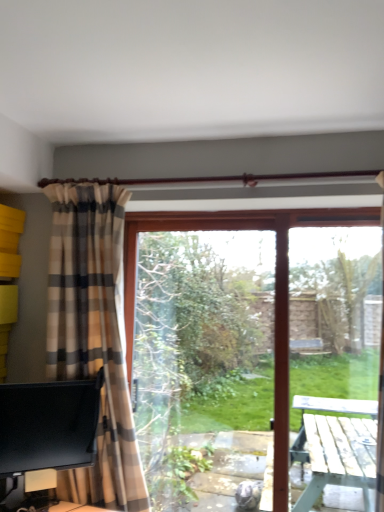
Where is `transparent glass window screen at center`? The image size is (384, 512). transparent glass window screen at center is located at coordinates (207, 326).

The image size is (384, 512). Identify the location of transparent glass window screen at center. (207, 326).

Considering the positions of point (69, 464) and point (193, 360), is point (69, 464) closer or farther from the camera than point (193, 360)?

Point (69, 464) is positioned closer to the camera compared to point (193, 360).

Is black glossy monitor at lower left in contact with transparent glass window screen at center?

black glossy monitor at lower left is not next to transparent glass window screen at center, and they're not touching.

Which of these two, black glossy monitor at lower left or transparent glass window screen at center, is wider?

With larger width is transparent glass window screen at center.

Between black glossy monitor at lower left and transparent glass window screen at center, which one appears on the right side from the viewer's perspective?

From the viewer's perspective, transparent glass window screen at center appears more on the right side.

From a real-world perspective, is transparent glass screen door at right physically below plaid fabric curtain at left?

Yes, from a real-world perspective, transparent glass screen door at right is below plaid fabric curtain at left.

Is transparent glass screen door at right facing towards plaid fabric curtain at left?

No, transparent glass screen door at right is not facing towards plaid fabric curtain at left.

Is the depth of transparent glass screen door at right greater than that of plaid fabric curtain at left?

Yes, it is behind plaid fabric curtain at left.

Considering the positions of objects transparent glass screen door at right and plaid fabric curtain at left in the image provided, who is more to the right, transparent glass screen door at right or plaid fabric curtain at left?

Positioned to the right is transparent glass screen door at right.

Considering the points (79, 192) and (167, 245), which point is behind, point (79, 192) or point (167, 245)?

Point (167, 245)

Can we say plaid fabric curtain at left lies outside transparent glass window screen at center?

That's correct, plaid fabric curtain at left is outside of transparent glass window screen at center.

Is plaid fabric curtain at left behind transparent glass window screen at center?

No, the depth of plaid fabric curtain at left is less than that of transparent glass window screen at center.

This screenshot has width=384, height=512. In order to click on window screen on the right of plaid fabric curtain at left in this screenshot , I will do `click(207, 326)`.

Locate an element on the screen. This screenshot has height=512, width=384. window screen that appears on the left of transparent glass screen door at right is located at coordinates (207, 326).

From the image's perspective, which one is positioned lower, transparent glass window screen at center or transparent glass screen door at right?

transparent glass window screen at center is shown below in the image.

What's the angular difference between transparent glass window screen at center and transparent glass screen door at right's facing directions?

The angular difference between transparent glass window screen at center and transparent glass screen door at right is 7.86e-05 degrees.

Which object is further away from the camera taking this photo, transparent glass window screen at center or transparent glass screen door at right?

transparent glass window screen at center is further from the camera.

Is transparent glass screen door at right next to transparent glass window screen at center?

No, transparent glass screen door at right is not touching transparent glass window screen at center.

Visually, is transparent glass screen door at right positioned to the left or to the right of transparent glass window screen at center?

transparent glass screen door at right is to the right of transparent glass window screen at center.

Could you tell me if transparent glass screen door at right is facing transparent glass window screen at center?

No, transparent glass screen door at right is not facing towards transparent glass window screen at center.

Considering the sizes of objects transparent glass screen door at right and transparent glass window screen at center in the image provided, who is thinner, transparent glass screen door at right or transparent glass window screen at center?

With smaller width is transparent glass window screen at center.

Looking at this image, which of these two, plaid fabric curtain at left or transparent glass screen door at right, is thinner?

transparent glass screen door at right is thinner.

In terms of size, does plaid fabric curtain at left appear bigger or smaller than transparent glass screen door at right?

Considering their sizes, plaid fabric curtain at left takes up more space than transparent glass screen door at right.

Between plaid fabric curtain at left and transparent glass screen door at right, which one appears on the left side from the viewer's perspective?

Positioned to the left is plaid fabric curtain at left.

From the image's perspective, is plaid fabric curtain at left above or below transparent glass screen door at right?

plaid fabric curtain at left is situated higher than transparent glass screen door at right in the image.

From the image's perspective, is transparent glass window screen at center located beneath black glossy monitor at lower left?

Incorrect, from the image's perspective, transparent glass window screen at center is higher than black glossy monitor at lower left.

Can you tell me how much transparent glass window screen at center and black glossy monitor at lower left differ in facing direction?

39.5 degrees separate the facing orientations of transparent glass window screen at center and black glossy monitor at lower left.

Find the location of a particular element. The height and width of the screenshot is (512, 384). window screen above the black glossy monitor at lower left (from a real-world perspective) is located at coordinates (207, 326).

From a real-world perspective, who is located higher, transparent glass window screen at center or black glossy monitor at lower left?

transparent glass window screen at center is physically above.

Identify the location of window screen that is above the black glossy monitor at lower left (from the image's perspective). This screenshot has width=384, height=512. (207, 326).

Where is `curtain above the transparent glass screen door at right (from a real-world perspective)`? Image resolution: width=384 pixels, height=512 pixels. curtain above the transparent glass screen door at right (from a real-world perspective) is located at coordinates (93, 336).

Which object lies nearer to the anchor point transparent glass screen door at right, black glossy monitor at lower left or plaid fabric curtain at left?

plaid fabric curtain at left is closer to transparent glass screen door at right.

Considering their positions, is black glossy monitor at lower left positioned closer to plaid fabric curtain at left than transparent glass screen door at right?

The object closer to plaid fabric curtain at left is black glossy monitor at lower left.

Which object lies further to the anchor point transparent glass screen door at right, black glossy monitor at lower left or transparent glass window screen at center?

Based on the image, black glossy monitor at lower left appears to be further to transparent glass screen door at right.

When comparing their distances from transparent glass screen door at right, does plaid fabric curtain at left or black glossy monitor at lower left seem further?

The object further to transparent glass screen door at right is black glossy monitor at lower left.

From the image, which object appears to be farther from transparent glass screen door at right, plaid fabric curtain at left or transparent glass window screen at center?

plaid fabric curtain at left lies further to transparent glass screen door at right than the other object.

Considering their positions, is transparent glass screen door at right positioned further to transparent glass window screen at center than plaid fabric curtain at left?

transparent glass screen door at right.

When comparing their distances from transparent glass screen door at right, does transparent glass window screen at center or plaid fabric curtain at left seem closer?

Based on the image, transparent glass window screen at center appears to be nearer to transparent glass screen door at right.

Which object lies nearer to the anchor point transparent glass window screen at center, transparent glass screen door at right or black glossy monitor at lower left?

Among the two, black glossy monitor at lower left is located nearer to transparent glass window screen at center.

Where is `curtain between black glossy monitor at lower left and transparent glass screen door at right from left to right`? This screenshot has height=512, width=384. curtain between black glossy monitor at lower left and transparent glass screen door at right from left to right is located at coordinates (93, 336).

Where is `curtain between black glossy monitor at lower left and transparent glass window screen at center`? curtain between black glossy monitor at lower left and transparent glass window screen at center is located at coordinates (93, 336).

The width and height of the screenshot is (384, 512). In order to click on window screen between plaid fabric curtain at left and transparent glass screen door at right in the horizontal direction in this screenshot , I will do `click(207, 326)`.

Where is `window screen between black glossy monitor at lower left and transparent glass screen door at right`? window screen between black glossy monitor at lower left and transparent glass screen door at right is located at coordinates (207, 326).